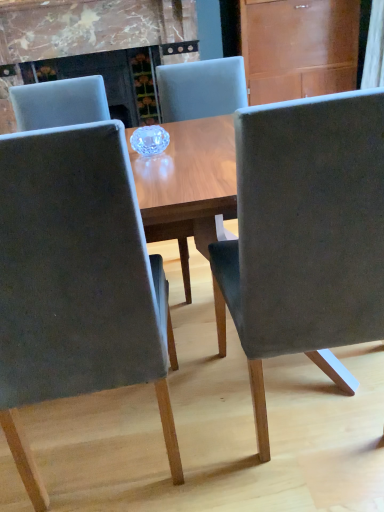
Question: Are wooden at upper right and suede-like gray chair at center, marked as the third chair in a left-to-right arrangement, beside each other?

Choices:
 (A) yes
 (B) no

Answer: (B)

Question: Can you confirm if wooden at upper right is smaller than suede-like gray chair at center, marked as the third chair in a left-to-right arrangement?

Choices:
 (A) no
 (B) yes

Answer: (A)

Question: Could you tell me if wooden at upper right is turned towards suede-like gray chair at center, marked as the third chair in a left-to-right arrangement?

Choices:
 (A) yes
 (B) no

Answer: (A)

Question: Can you confirm if wooden at upper right is shorter than suede-like gray chair at center, arranged as the 1th chair when viewed from the right?

Choices:
 (A) yes
 (B) no

Answer: (A)

Question: Is suede-like gray chair at center, arranged as the 1th chair when viewed from the right, surrounded by wooden at upper right?

Choices:
 (A) no
 (B) yes

Answer: (A)

Question: In the image, is velvet gray chair at center, the first chair from the left, positioned in front of or behind suede-like gray chair at center, arranged as the 1th chair when viewed from the right?

Choices:
 (A) behind
 (B) front

Answer: (B)

Question: Is velvet gray chair at center, placed as the third chair when sorted from right to left, inside the boundaries of suede-like gray chair at center, arranged as the 1th chair when viewed from the right, or outside?

Choices:
 (A) inside
 (B) outside

Answer: (B)

Question: Is velvet gray chair at center, the first chair from the left, wider or thinner than suede-like gray chair at center, arranged as the 1th chair when viewed from the right?

Choices:
 (A) thin
 (B) wide

Answer: (A)

Question: Visually, is velvet gray chair at center, the first chair from the left, positioned to the left or to the right of suede-like gray chair at center, marked as the third chair in a left-to-right arrangement?

Choices:
 (A) right
 (B) left

Answer: (B)

Question: Is point (291, 101) closer or farther from the camera than point (200, 74)?

Choices:
 (A) closer
 (B) farther

Answer: (A)

Question: In the image, is suede-like gray chair at center, arranged as the 1th chair when viewed from the right, positioned in front of or behind suede-like gray chair at center, the second chair when ordered from left to right?

Choices:
 (A) front
 (B) behind

Answer: (A)

Question: From the image's perspective, is suede-like gray chair at center, arranged as the 1th chair when viewed from the right, above or below suede-like gray chair at center, the second chair when ordered from left to right?

Choices:
 (A) above
 (B) below

Answer: (B)

Question: In terms of size, does suede-like gray chair at center, marked as the third chair in a left-to-right arrangement, appear bigger or smaller than suede-like gray chair at center, the second chair when ordered from left to right?

Choices:
 (A) small
 (B) big

Answer: (A)

Question: From a real-world perspective, relative to suede-like gray chair at center, placed as the 2th chair when sorted from right to left, is wooden at upper right vertically above or below?

Choices:
 (A) below
 (B) above

Answer: (B)

Question: From the image's perspective, relative to suede-like gray chair at center, placed as the 2th chair when sorted from right to left, is wooden at upper right above or below?

Choices:
 (A) below
 (B) above

Answer: (B)